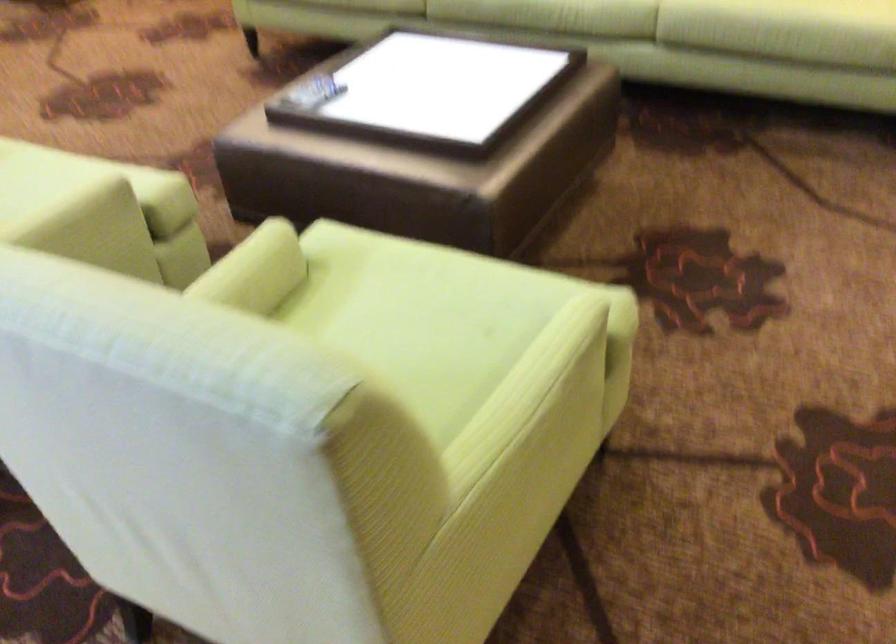
This screenshot has height=644, width=896. Describe the element at coordinates (860, 11) in the screenshot. I see `the sofa sitting surface` at that location.